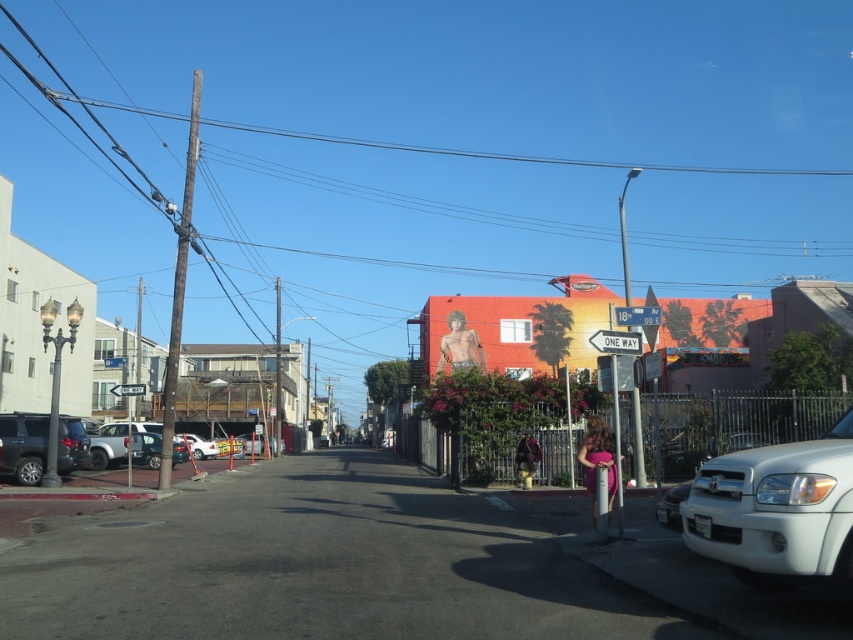
Question: Considering the real-world distances, which object is closest to the metallic blue street sign at upper center?

Choices:
 (A) white matte car at left
 (B) metallic wire at upper center
 (C) white plastic street sign at upper center

Answer: (C)

Question: Does white matte car at center come behind white plastic street sign at upper center?

Choices:
 (A) no
 (B) yes

Answer: (B)

Question: Is metallic wire at upper center smaller than white plastic street sign at upper center?

Choices:
 (A) no
 (B) yes

Answer: (A)

Question: Among these objects, which one is nearest to the camera?

Choices:
 (A) metallic wire at upper center
 (B) white matte car at left

Answer: (B)

Question: Considering the real-world distances, which object is closest to the wooden utility pole at left?

Choices:
 (A) white matte car at center
 (B) white matte car at left
 (C) matte gray suv at left

Answer: (B)

Question: Is wooden utility pole at left in front of white plastic street sign at center right?

Choices:
 (A) no
 (B) yes

Answer: (A)